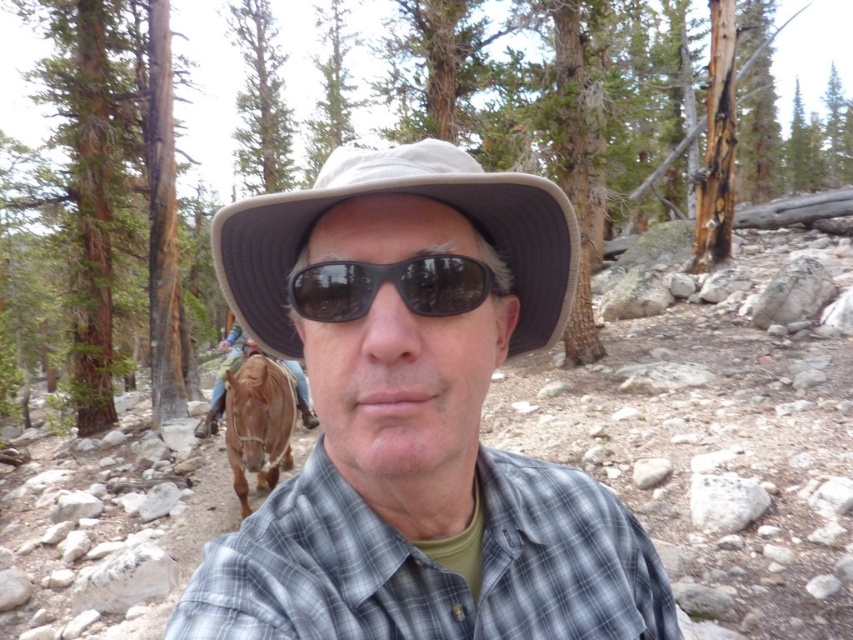
Question: In this image, where is gray checkered shirt at center located relative to black matte sunglasses at center?

Choices:
 (A) above
 (B) below

Answer: (B)

Question: Among these points, which one is nearest to the camera?

Choices:
 (A) (90, 406)
 (B) (190, 54)
 (C) (212, 241)
 (D) (532, 188)

Answer: (D)

Question: Does plaid fabric shirt at center have a smaller size compared to black matte sunglasses at center?

Choices:
 (A) no
 (B) yes

Answer: (A)

Question: Based on their relative distances, which object is farther from the black matte sunglasses at center?

Choices:
 (A) beige fabric hat at center
 (B) plaid fabric shirt at center

Answer: (B)

Question: Which point appears closest to the camera in this image?

Choices:
 (A) (368, 285)
 (B) (277, 218)
 (C) (108, 84)
 (D) (575, 282)

Answer: (A)

Question: Is gray checkered shirt at center thinner than black matte sunglasses at center?

Choices:
 (A) no
 (B) yes

Answer: (A)